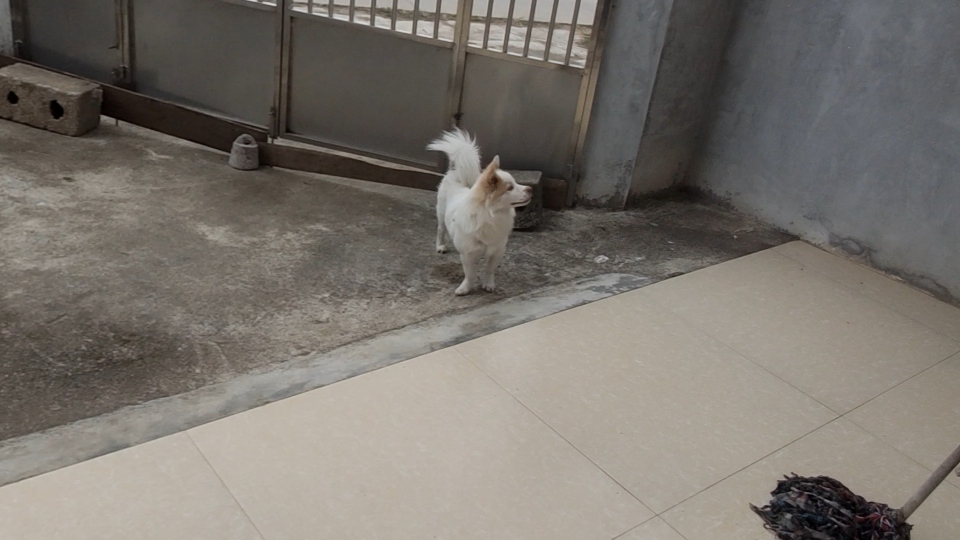
Where is `grey wall`? grey wall is located at coordinates (640, 27), (624, 132), (684, 134), (693, 39), (784, 36), (947, 28), (938, 239), (792, 183).